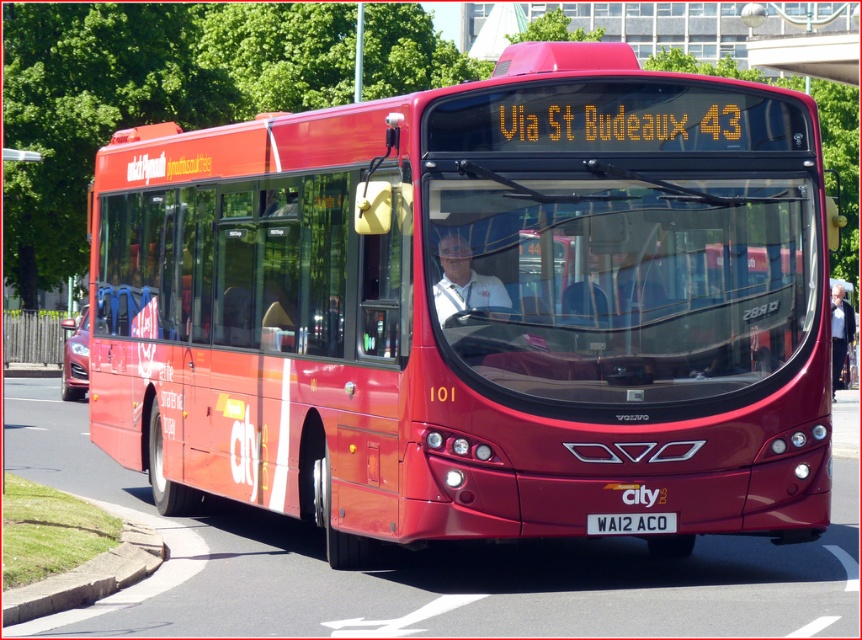
Question: Does matte red bus at center have a lesser width compared to white plastic license plate at center?

Choices:
 (A) yes
 (B) no

Answer: (A)

Question: Can you confirm if white shirt at center is smaller than white plastic license plate at center?

Choices:
 (A) yes
 (B) no

Answer: (B)

Question: Which point is closer to the camera taking this photo?

Choices:
 (A) (846, 330)
 (B) (592, 532)
 (C) (445, 253)
 (D) (794, 124)

Answer: (C)

Question: Which object appears closest to the camera in this image?

Choices:
 (A) white plastic license plate at center
 (B) white fabric jacket at center
 (C) matte red bus at center

Answer: (A)

Question: Which point appears farthest from the camera in this image?

Choices:
 (A) (483, 301)
 (B) (478, 474)
 (C) (669, 522)
 (D) (842, 316)

Answer: (D)

Question: Can you confirm if white shirt at center is positioned to the left of white fabric jacket at center?

Choices:
 (A) yes
 (B) no

Answer: (A)